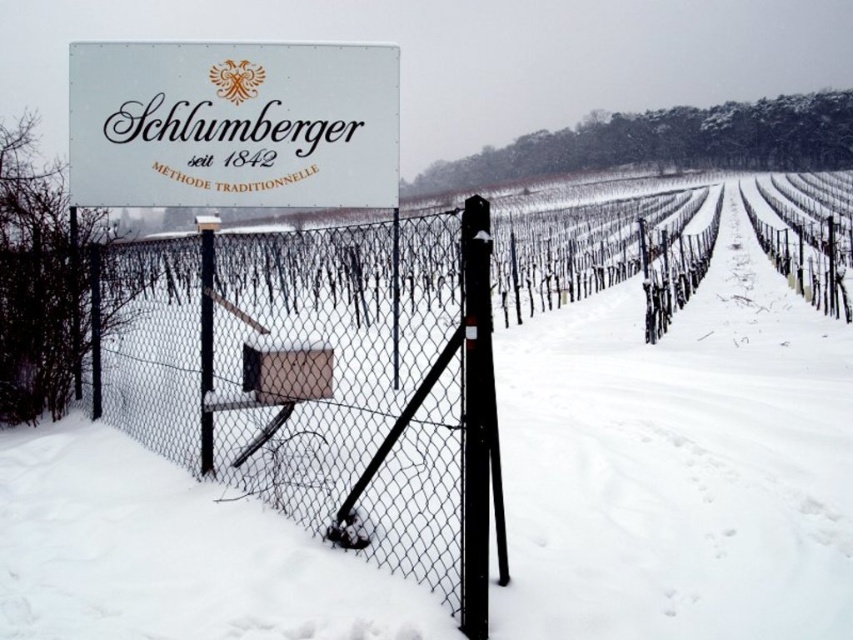
You are a visitor standing at the entrance of the vineyard and see the white powdery snow at center and the white matte sign at upper center. Which object is positioned to the right of the other?

The white powdery snow at center is to the right of the white matte sign at upper center.

You are a delivery person standing at the entrance of the vineyard, and you need to place a box of wine bottles on the white matte sign at upper center. The box is 12 feet long. Can you safely place the box on the ground between the white powdery snow at center and the sign without the box overlapping either object?

The distance between the white powdery snow at center and the white matte sign at upper center is 11.71 feet. Since the box is 12 feet long, it would overlap one of the objects when placed between them, so it cannot be safely placed without overlapping.

You are standing at the entrance of the vineyard and want to walk towards the two points marked in the image. Which point would you reach first, point [80,481] or point [160,109]?

You would reach point [80,481] first because it is closer to you than point [160,109].